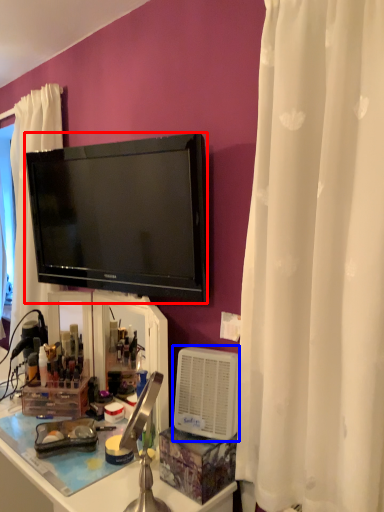
Question: Which object appears closest to the camera in this image, television (highlighted by a red box) or appliance (highlighted by a blue box)?

Choices:
 (A) television
 (B) appliance

Answer: (B)